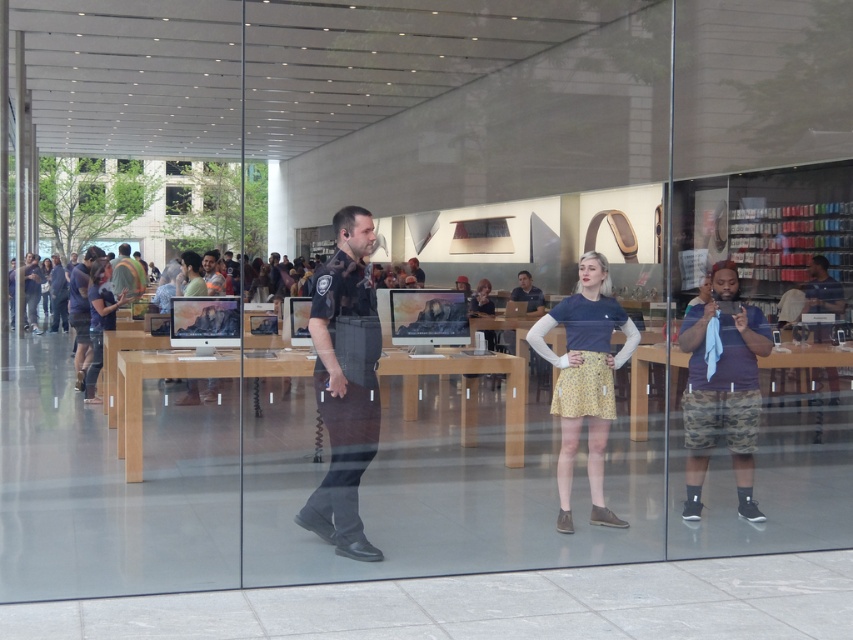
Question: Estimate the real-world distances between objects in this image. Which object is farther from the black uniformed officer at center?

Choices:
 (A) camo shorts at right
 (B) orange safety vest at center

Answer: (B)

Question: Which point is farther to the camera?

Choices:
 (A) (531, 300)
 (B) (410, 273)
 (C) (604, 298)

Answer: (B)

Question: Is camo shorts at right to the right of dark blue shirt at center from the viewer's perspective?

Choices:
 (A) yes
 (B) no

Answer: (A)

Question: Can you confirm if matte black shirt at center is positioned above orange safety vest at center?

Choices:
 (A) no
 (B) yes

Answer: (A)

Question: Which object is positioned closest to the black uniformed officer at center?

Choices:
 (A) orange safety vest at center
 (B) dark blue shirt at center
 (C) camo shorts at right

Answer: (C)

Question: Does black uniformed officer at center appear on the right side of dark blue shirt at center?

Choices:
 (A) no
 (B) yes

Answer: (A)